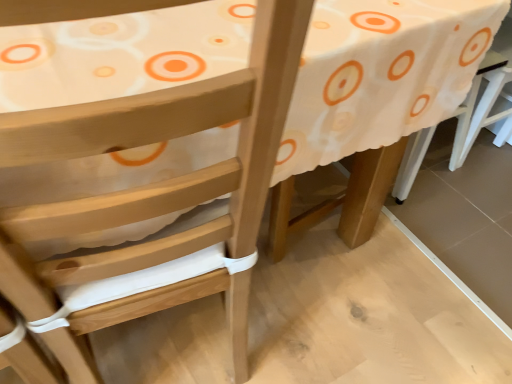
Question: Is wooden table at center positioned with its back to white plastic chair at right?

Choices:
 (A) no
 (B) yes

Answer: (B)

Question: From the image's perspective, is wooden table at center beneath white plastic chair at right?

Choices:
 (A) yes
 (B) no

Answer: (A)

Question: From the image's perspective, would you say wooden table at center is positioned over white plastic chair at right?

Choices:
 (A) no
 (B) yes

Answer: (A)

Question: Is white plastic chair at right inside wooden table at center?

Choices:
 (A) no
 (B) yes

Answer: (A)

Question: From a real-world perspective, is wooden table at center located higher than white plastic chair at right?

Choices:
 (A) yes
 (B) no

Answer: (A)

Question: Considering the relative sizes of wooden table at center and white plastic chair at right in the image provided, is wooden table at center wider than white plastic chair at right?

Choices:
 (A) no
 (B) yes

Answer: (B)

Question: Can you confirm if white plastic chair at right is positioned to the left of wooden table at center?

Choices:
 (A) no
 (B) yes

Answer: (A)

Question: From a real-world perspective, does white plastic chair at right sit lower than wooden table at center?

Choices:
 (A) yes
 (B) no

Answer: (A)

Question: Does white plastic chair at right have a smaller size compared to wooden table at center?

Choices:
 (A) yes
 (B) no

Answer: (A)

Question: Considering the relative positions of white plastic chair at right and wooden table at center in the image provided, is white plastic chair at right to the right of wooden table at center from the viewer's perspective?

Choices:
 (A) yes
 (B) no

Answer: (A)

Question: Can wooden table at center be found inside white plastic chair at right?

Choices:
 (A) yes
 (B) no

Answer: (B)

Question: Does white plastic chair at right turn towards wooden table at center?

Choices:
 (A) yes
 (B) no

Answer: (B)

Question: Considering the positions of wooden table at center and white plastic chair at right in the image, is wooden table at center bigger or smaller than white plastic chair at right?

Choices:
 (A) small
 (B) big

Answer: (B)